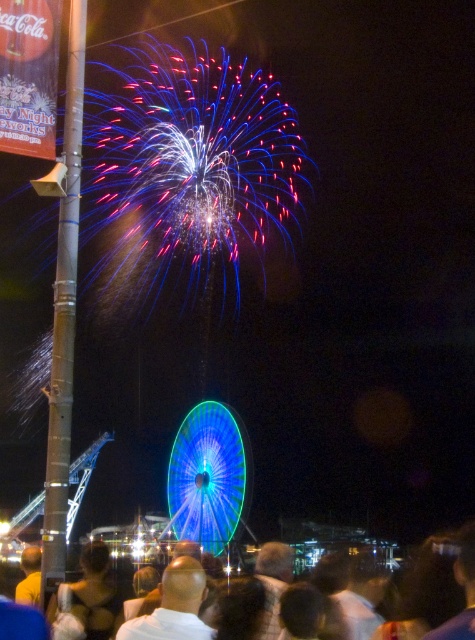
Question: Which object is closer to the camera taking this photo?

Choices:
 (A) dark hair at lower center
 (B) translucent blue ferris wheel at center

Answer: (A)

Question: Which point appears farthest from the camera in this image?

Choices:
 (A) (73, 35)
 (B) (218, 529)

Answer: (B)

Question: Is metallic pole at left further to the viewer compared to dark hair at lower center?

Choices:
 (A) no
 (B) yes

Answer: (A)

Question: Can you confirm if metallic pole at left is smaller than translucent blue ferris wheel at center?

Choices:
 (A) no
 (B) yes

Answer: (B)

Question: Among these points, which one is farthest from the camera?

Choices:
 (A) (217, 513)
 (B) (64, 381)

Answer: (A)

Question: Can you confirm if metallic pole at left is positioned to the right of dark hair at lower center?

Choices:
 (A) yes
 (B) no

Answer: (B)